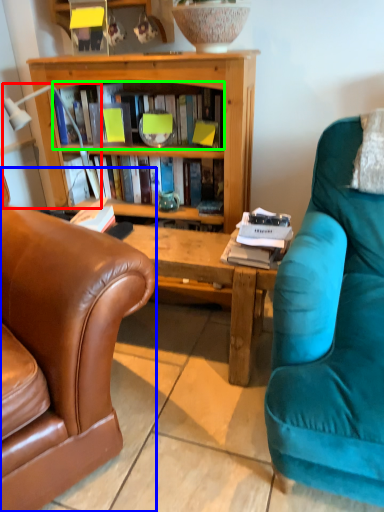
Question: Which is farther away from lamp (highlighted by a red box)? chair (highlighted by a blue box) or book (highlighted by a green box)?

Choices:
 (A) chair
 (B) book

Answer: (A)